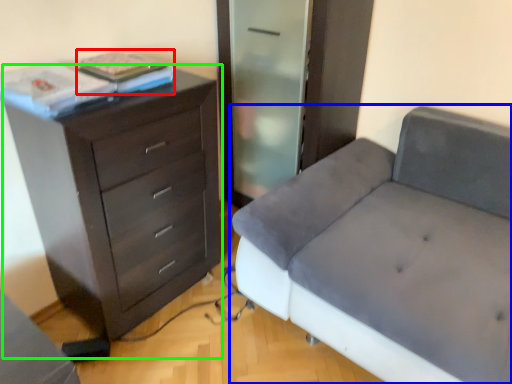
Question: Which is farther away from book (highlighted by a red box)? studio couch (highlighted by a blue box) or chest of drawers (highlighted by a green box)?

Choices:
 (A) studio couch
 (B) chest of drawers

Answer: (A)